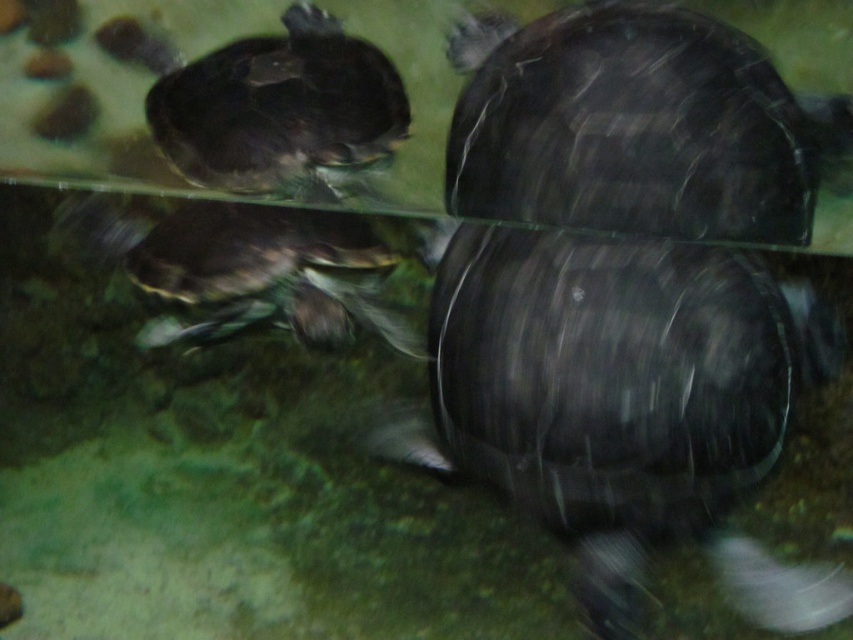
Question: Which object appears closest to the camera in this image?

Choices:
 (A) shiny black tortoise at center
 (B) shiny dark green tortoise at center

Answer: (A)

Question: Among these objects, which one is farthest from the camera?

Choices:
 (A) shiny black tortoise at upper center
 (B) shiny black tortoise at center
 (C) shiny dark green tortoise at center

Answer: (A)

Question: Which of the following is the farthest from the observer?

Choices:
 (A) shiny black tortoise at upper center
 (B) shiny black tortoise at center

Answer: (A)

Question: Does shiny black tortoise at center have a larger size compared to shiny dark green tortoise at center?

Choices:
 (A) no
 (B) yes

Answer: (B)

Question: Does shiny black tortoise at center appear under shiny black tortoise at upper center?

Choices:
 (A) no
 (B) yes

Answer: (B)

Question: Can you confirm if shiny black tortoise at upper center is positioned below shiny dark green tortoise at center?

Choices:
 (A) no
 (B) yes

Answer: (A)